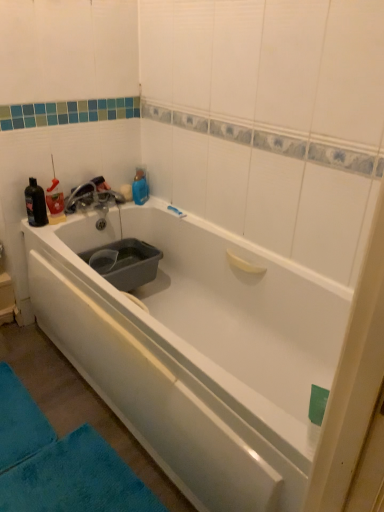
Question: From a real-world perspective, does black matte bottle at upper left, placed as the 1th bottle when sorted from left to right, sit lower than matte silver faucet at upper left?

Choices:
 (A) yes
 (B) no

Answer: (B)

Question: From a real-world perspective, does black matte bottle at upper left, positioned as the 2th bottle in right-to-left order, stand above matte silver faucet at upper left?

Choices:
 (A) yes
 (B) no

Answer: (A)

Question: Is black matte bottle at upper left, positioned as the 2th bottle in right-to-left order, closer to camera compared to matte silver faucet at upper left?

Choices:
 (A) no
 (B) yes

Answer: (B)

Question: Is black matte bottle at upper left, placed as the 1th bottle when sorted from left to right, bigger than matte silver faucet at upper left?

Choices:
 (A) no
 (B) yes

Answer: (A)

Question: Is matte silver faucet at upper left at the back of black matte bottle at upper left, placed as the 1th bottle when sorted from left to right?

Choices:
 (A) yes
 (B) no

Answer: (B)

Question: Is gray plastic basin at left bigger or smaller than translucent plastic bottle at upper left, which ranks as the first bottle in right-to-left order?

Choices:
 (A) small
 (B) big

Answer: (B)

Question: Relative to translucent plastic bottle at upper left, arranged as the second bottle when viewed from the left, is gray plastic basin at left in front or behind?

Choices:
 (A) front
 (B) behind

Answer: (A)

Question: Is point (135, 244) positioned closer to the camera than point (52, 179)?

Choices:
 (A) farther
 (B) closer

Answer: (A)

Question: Is gray plastic basin at left wider or thinner than translucent plastic bottle at upper left, which ranks as the first bottle in right-to-left order?

Choices:
 (A) thin
 (B) wide

Answer: (B)

Question: Is black matte bottle at upper left, positioned as the 2th bottle in right-to-left order, inside the boundaries of blue plush bath mat at lower left, marked as the 2th bath mat in a left-to-right arrangement, or outside?

Choices:
 (A) inside
 (B) outside

Answer: (B)

Question: From a real-world perspective, is black matte bottle at upper left, placed as the 1th bottle when sorted from left to right, physically located above or below blue plush bath mat at lower left, the first bath mat viewed from the right?

Choices:
 (A) above
 (B) below

Answer: (A)

Question: From their relative heights in the image, would you say black matte bottle at upper left, placed as the 1th bottle when sorted from left to right, is taller or shorter than blue plush bath mat at lower left, marked as the 2th bath mat in a left-to-right arrangement?

Choices:
 (A) short
 (B) tall

Answer: (B)

Question: In terms of width, does black matte bottle at upper left, placed as the 1th bottle when sorted from left to right, look wider or thinner when compared to blue plush bath mat at lower left, the first bath mat viewed from the right?

Choices:
 (A) thin
 (B) wide

Answer: (A)

Question: From the image's perspective, relative to matte silver faucet at upper left, is gray plastic basin at left above or below?

Choices:
 (A) above
 (B) below

Answer: (B)

Question: Do you think gray plastic basin at left is within matte silver faucet at upper left, or outside of it?

Choices:
 (A) inside
 (B) outside

Answer: (B)